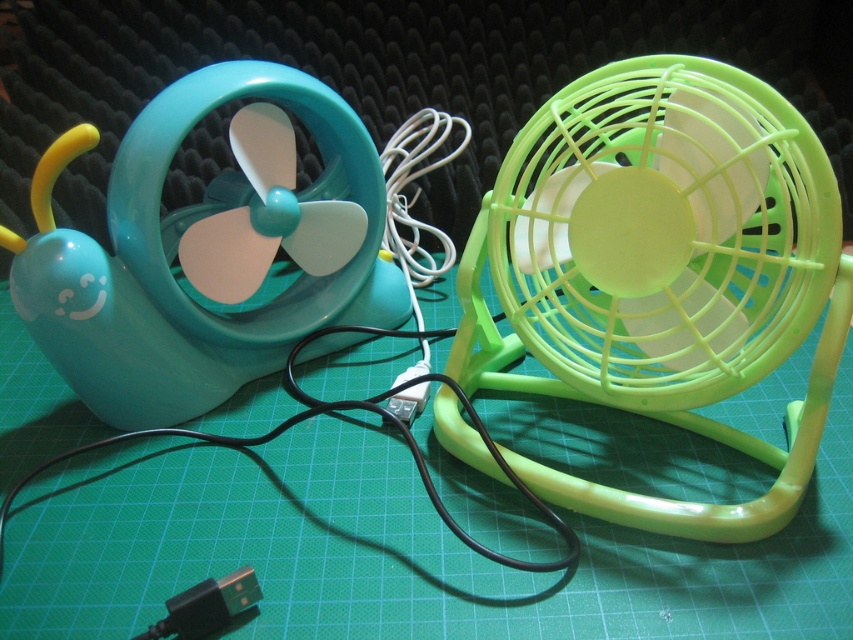
You are setting up a display on a green cutting mat with grid lines. You have two USB fans here. One is a snail design with a teal body, and the other is a standard lime green fan. You need to place a decorative sticker exactly at the point marked by coordinates point (660,273). Which fan should you place the sticker on?

The lime green plastic fan at right is located at point (660,273), so you should place the sticker on the lime green plastic fan at right.